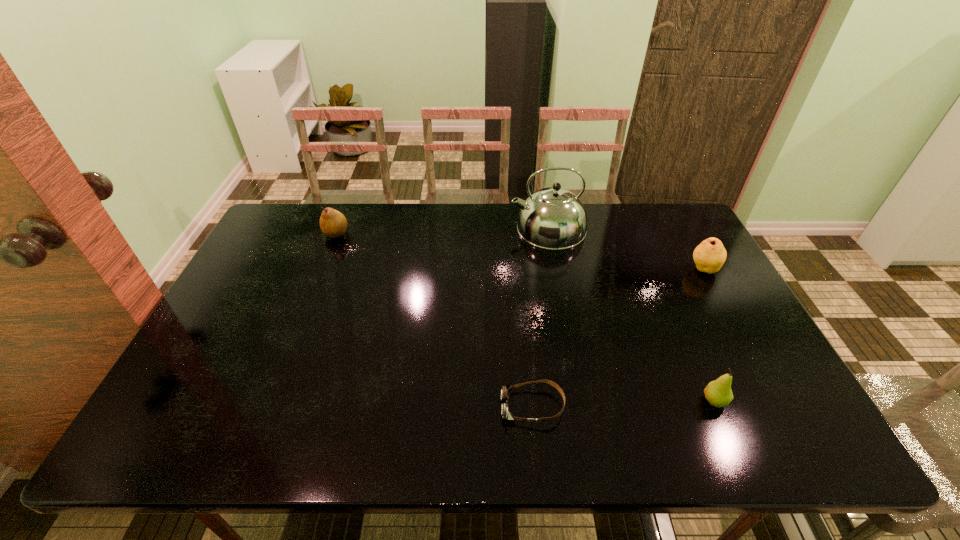
Find the location of a particular element. The image size is (960, 540). free space located 0.360m from the spout of the kettle is located at coordinates [405, 228].

Identify the location of vacant space situated 0.380m on the front of the farthest pear. The height and width of the screenshot is (540, 960). (299, 330).

Where is `vacant area situated 0.180m on the left of the rightmost pear`? vacant area situated 0.180m on the left of the rightmost pear is located at coordinates (631, 269).

At what (x,y) coordinates should I click in order to perform the action: click on vacant space located 0.090m on the back of the nearest pear. Please return your answer as a coordinate pair (x, y). The height and width of the screenshot is (540, 960). Looking at the image, I should click on (696, 358).

The width and height of the screenshot is (960, 540). I want to click on vacant space positioned on the front-facing side of the goggles, so click(336, 406).

At what (x,y) coordinates should I click in order to perform the action: click on vacant space located 0.370m on the front-facing side of the goggles. Please return your answer as a coordinate pair (x, y). This screenshot has height=540, width=960. Looking at the image, I should click on (340, 406).

Identify the location of free space located on the front-facing side of the goggles. (449, 406).

Locate an element on the screen. This screenshot has height=540, width=960. kettle positioned at the far edge is located at coordinates (553, 218).

Find the location of a particular element. This screenshot has width=960, height=540. pear at the far edge is located at coordinates point(333,224).

Where is `object present at the near edge`? This screenshot has width=960, height=540. object present at the near edge is located at coordinates (506, 390).